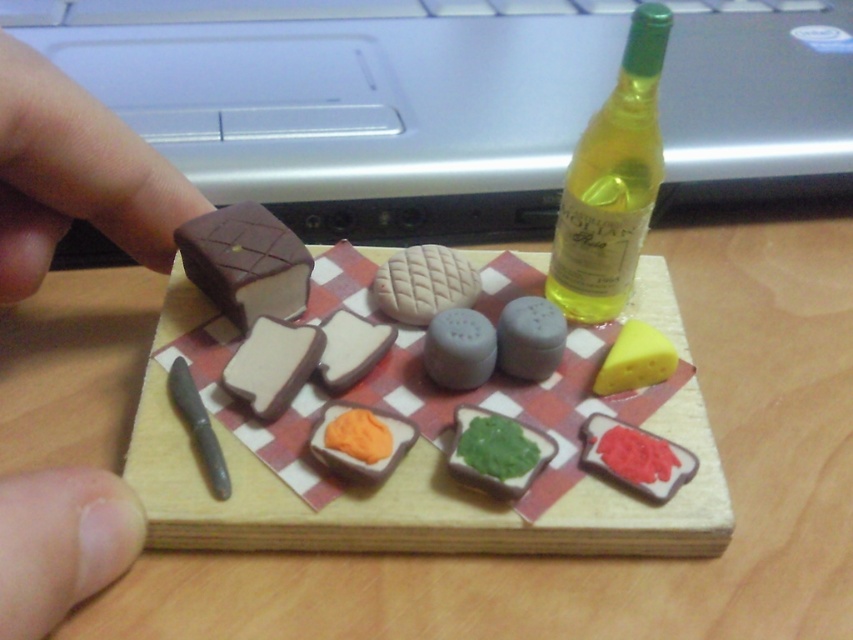
You are arranging miniature food items on a checkered cutting board. You have a green glass bottle at upper right and a green matte spread at center. Which object is nearer to you?

The green glass bottle at upper right is closer to the viewer than the green matte spread at center.

You are holding a green glass bottle at upper right that you want to place on a shelf. The shelf is 20 inches away from you. Can the bottle fit on the shelf?

The green glass bottle at upper right is 19.01 inches from the camera, so it will fit on the shelf since the shelf is 20 inches away.